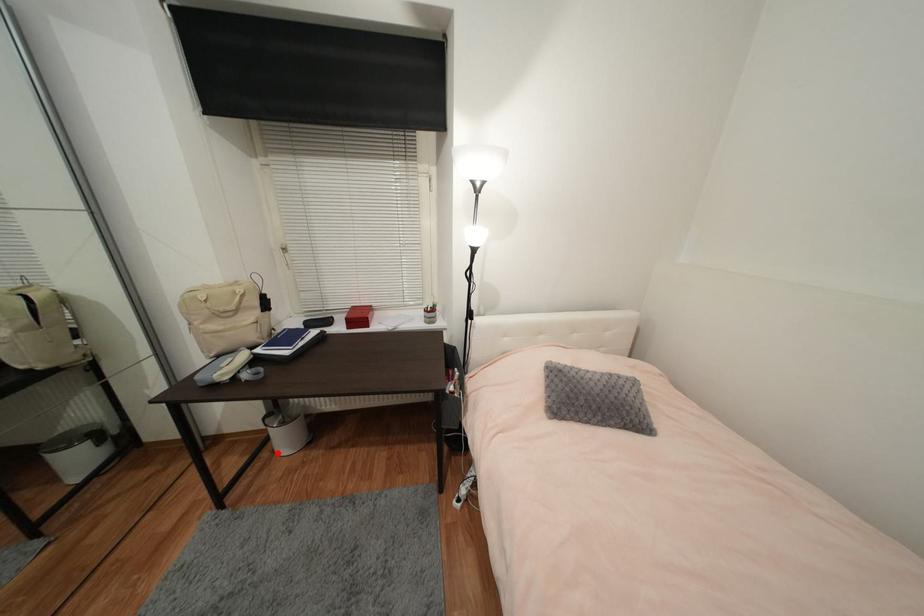
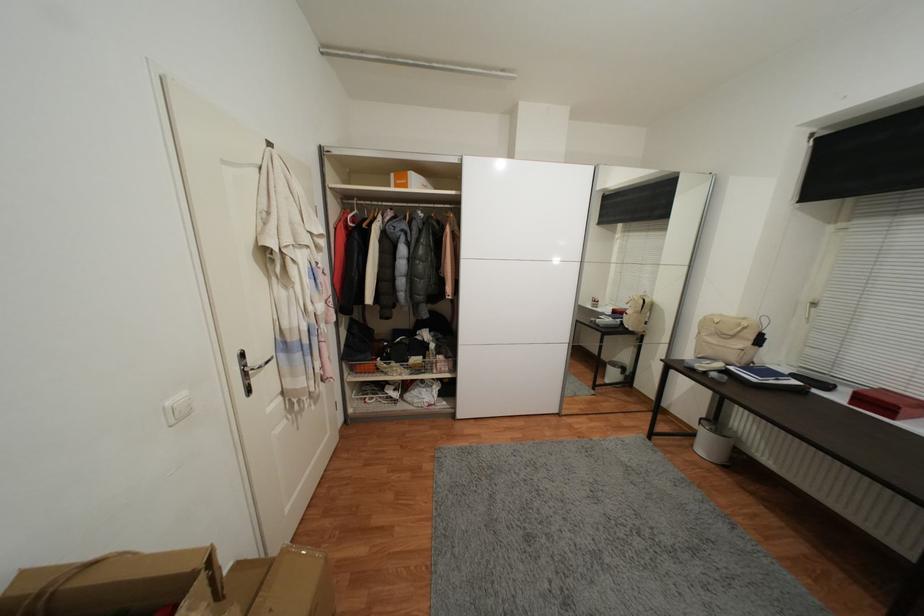
Question: I am providing you with two images of the same scene from different viewpoints. A red point is shown in image1. For the corresponding object point in image2, is it positioned nearer or farther from the camera?

Choices:
 (A) Nearer
 (B) Farther

Answer: (A)